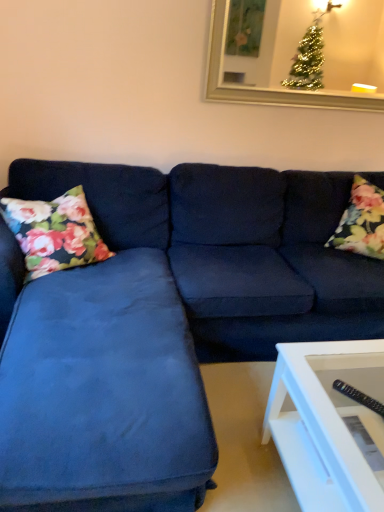
Question: Is floral fabric pillow at right, the first pillow viewed from the right, at the back of floral fabric pillow at left, placed as the 2th pillow when sorted from right to left?

Choices:
 (A) no
 (B) yes

Answer: (A)

Question: Is floral fabric pillow at right, which ranks as the second pillow in left-to-right order, inside floral fabric pillow at left, placed as the 2th pillow when sorted from right to left?

Choices:
 (A) no
 (B) yes

Answer: (A)

Question: Does floral fabric pillow at left, placed as the 2th pillow when sorted from right to left, appear on the right side of floral fabric pillow at right, which ranks as the second pillow in left-to-right order?

Choices:
 (A) no
 (B) yes

Answer: (A)

Question: Is floral fabric pillow at left, which ranks as the first pillow in left-to-right order, positioned behind floral fabric pillow at right, which ranks as the second pillow in left-to-right order?

Choices:
 (A) yes
 (B) no

Answer: (B)

Question: Can we say floral fabric pillow at left, which ranks as the first pillow in left-to-right order, lies outside floral fabric pillow at right, which ranks as the second pillow in left-to-right order?

Choices:
 (A) yes
 (B) no

Answer: (A)

Question: Looking at their shapes, would you say suede blue couch at center is wider or thinner than floral fabric pillow at right, the first pillow viewed from the right?

Choices:
 (A) thin
 (B) wide

Answer: (B)

Question: From the image's perspective, is suede blue couch at center located above or below floral fabric pillow at right, which ranks as the second pillow in left-to-right order?

Choices:
 (A) below
 (B) above

Answer: (A)

Question: From a real-world perspective, is suede blue couch at center positioned above or below floral fabric pillow at right, the first pillow viewed from the right?

Choices:
 (A) above
 (B) below

Answer: (B)

Question: Is suede blue couch at center in front of or behind floral fabric pillow at right, which ranks as the second pillow in left-to-right order, in the image?

Choices:
 (A) behind
 (B) front

Answer: (B)

Question: Considering the positions of point (107, 444) and point (69, 208), is point (107, 444) closer or farther from the camera than point (69, 208)?

Choices:
 (A) farther
 (B) closer

Answer: (B)

Question: Considering the relative positions of suede blue couch at center and floral fabric pillow at left, placed as the 2th pillow when sorted from right to left, in the image provided, is suede blue couch at center to the left or to the right of floral fabric pillow at left, placed as the 2th pillow when sorted from right to left,?

Choices:
 (A) right
 (B) left

Answer: (A)

Question: From a real-world perspective, is suede blue couch at center above or below floral fabric pillow at left, which ranks as the first pillow in left-to-right order?

Choices:
 (A) below
 (B) above

Answer: (A)

Question: Is suede blue couch at center in front of or behind floral fabric pillow at left, which ranks as the first pillow in left-to-right order, in the image?

Choices:
 (A) behind
 (B) front

Answer: (B)

Question: From the image's perspective, is floral fabric pillow at left, which ranks as the first pillow in left-to-right order, above or below floral fabric pillow at right, the first pillow viewed from the right?

Choices:
 (A) below
 (B) above

Answer: (A)

Question: Is point (39, 206) positioned closer to the camera than point (374, 202)?

Choices:
 (A) farther
 (B) closer

Answer: (B)